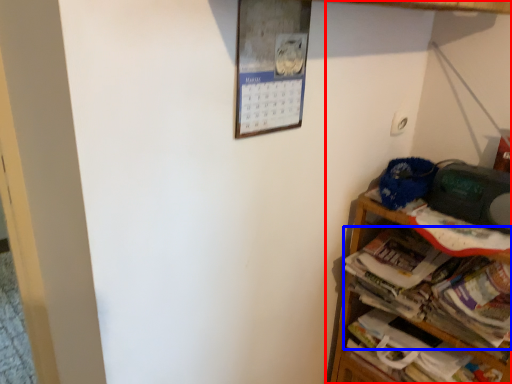
Question: Which point is further to the camera, shelf (highlighted by a red box) or magazine (highlighted by a blue box)?

Choices:
 (A) shelf
 (B) magazine

Answer: (B)